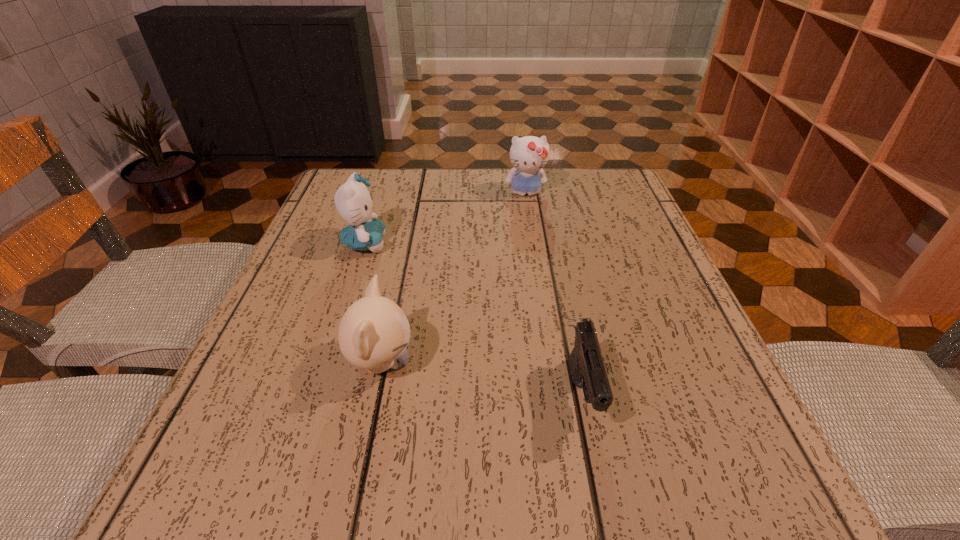
Where is `the farthest kitten`? the farthest kitten is located at coordinates (529, 154).

At what (x,y) coordinates should I click in order to perform the action: click on the rightmost kitten. Please return your answer as a coordinate pair (x, y). The height and width of the screenshot is (540, 960). Looking at the image, I should click on (529, 154).

Image resolution: width=960 pixels, height=540 pixels. What are the coordinates of `the second nearest kitten` in the screenshot? It's located at (354, 203).

Find the location of `the nearest kitten`. the nearest kitten is located at coordinates (x=374, y=332).

This screenshot has height=540, width=960. I want to click on pistol, so click(x=586, y=365).

The height and width of the screenshot is (540, 960). Find the location of `vacant space located on the front-facing side of the farthest kitten`. vacant space located on the front-facing side of the farthest kitten is located at coordinates (544, 319).

The image size is (960, 540). I want to click on vacant space situated 0.110m on the face of the second nearest kitten, so click(x=439, y=244).

The image size is (960, 540). I want to click on free space located 0.060m on the face of the nearest kitten, so click(x=452, y=363).

Find the location of a particular element. The height and width of the screenshot is (540, 960). blank area located 0.070m at the barrel of the pistol is located at coordinates (604, 495).

This screenshot has width=960, height=540. Find the location of `object at the far edge`. object at the far edge is located at coordinates [x=529, y=154].